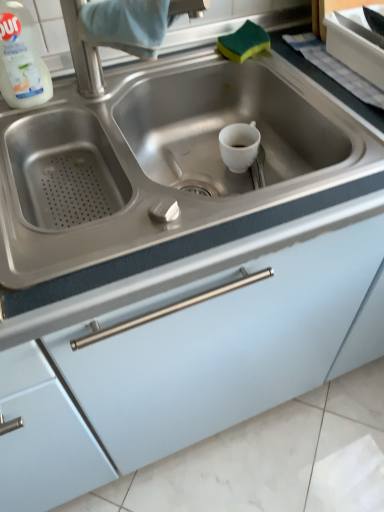
Question: Considering the relative positions of stainless steel faucet at upper center and matte white cabinet at center in the image provided, is stainless steel faucet at upper center to the left or to the right of matte white cabinet at center?

Choices:
 (A) left
 (B) right

Answer: (A)

Question: Considering the positions of stainless steel faucet at upper center and matte white cabinet at center in the image, is stainless steel faucet at upper center bigger or smaller than matte white cabinet at center?

Choices:
 (A) big
 (B) small

Answer: (B)

Question: Which of these objects is positioned closest to the stainless steel faucet at upper center?

Choices:
 (A) white plastic bottle at upper left
 (B) matte white cabinet at center
 (C) stainless steel sink at center

Answer: (A)

Question: Which is farther from the white plastic bottle at upper left?

Choices:
 (A) stainless steel sink at center
 (B) stainless steel faucet at upper center
 (C) matte white cabinet at center

Answer: (C)